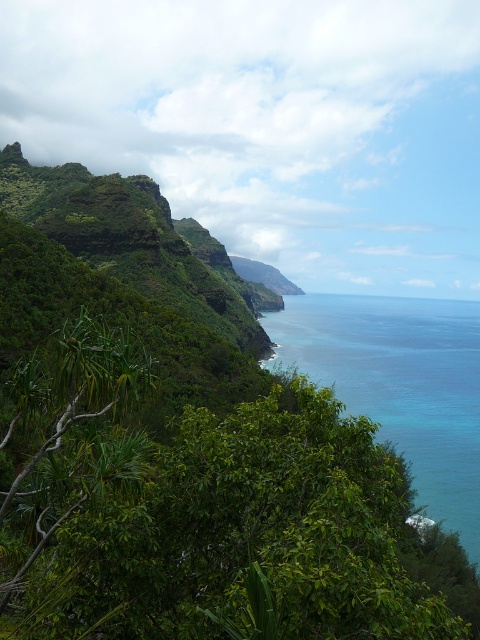
You are standing at the top of the cliff overlooking the coastal landscape. You notice the green leafy foliage at lower left and the blue clear water at center. Which object appears shorter in height when viewed from your vantage point?

The green leafy foliage at lower left appears shorter in height compared to the blue clear water at center because the description states that the foliage is not as tall as the water.

You are standing at the top of the cliff overlooking the coastal landscape. You see the green leafy foliage at lower left and the blue clear water at center. Which object is nearer to you?

The green leafy foliage at lower left is closer to the viewer than the blue clear water at center.